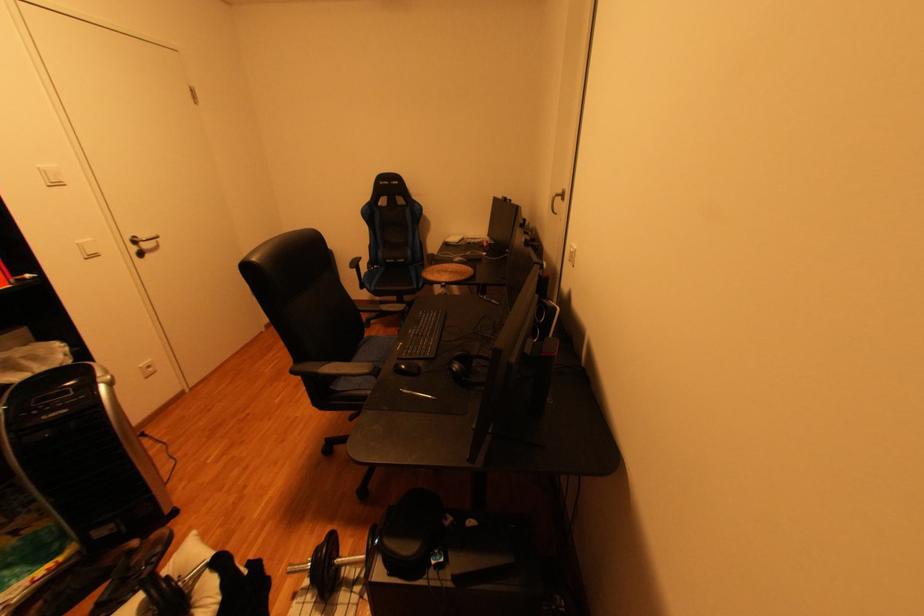
Find where to pull the silver door handle. Please return your answer as a coordinate pair (x, y).

(144, 243)